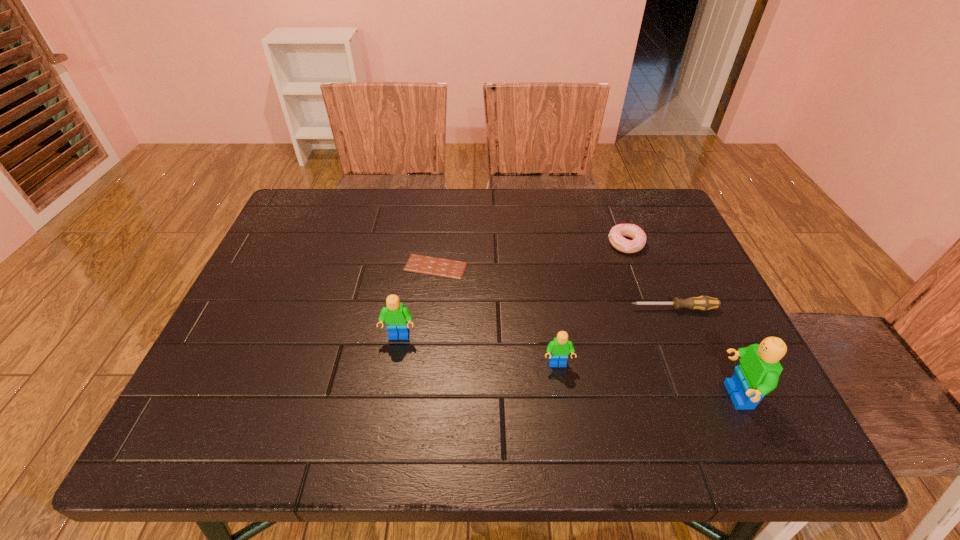
All Legos are currently evenly spaced. To continue this pattern, where would you add another Lego on the left? Please point out a vacant spot. Please provide its 2D coordinates. Your answer should be formatted as a tuple, i.e. [(x, y)], where the tuple contains the x and y coordinates of a point satisfying the conditions above.

[(257, 312)]